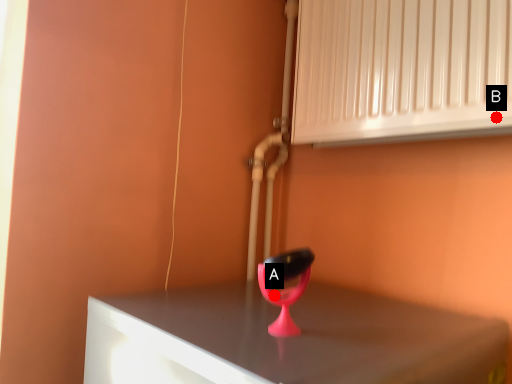
Question: Two points are circled on the image, labeled by A and B beside each circle. Which point appears farthest from the camera in this image?

Choices:
 (A) A is further
 (B) B is further

Answer: (B)